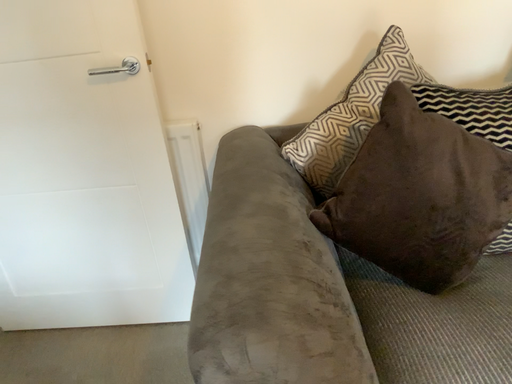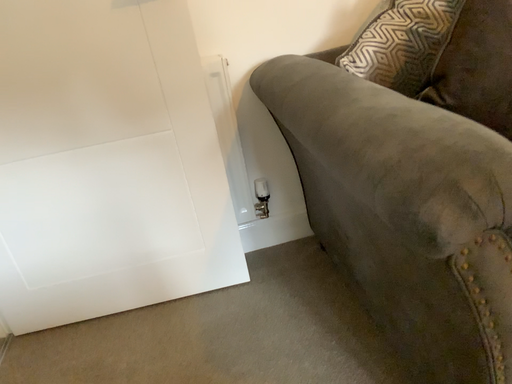
Question: Which way did the camera rotate in the video?

Choices:
 (A) rotated right
 (B) rotated left

Answer: (A)